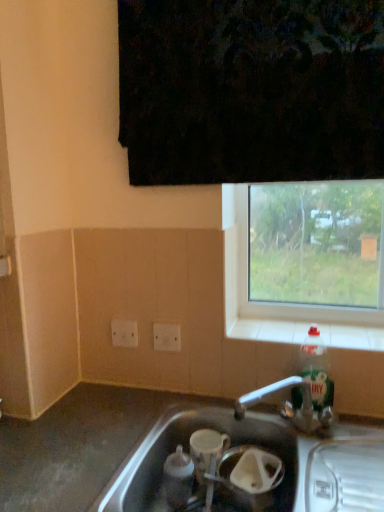
Question: Considering the relative positions of white plastic electric outlet at lower left, the 2th electric outlet when ordered from front to back, and white tile at lower right in the image provided, is white plastic electric outlet at lower left, the 2th electric outlet when ordered from front to back, in front of white tile at lower right?

Choices:
 (A) no
 (B) yes

Answer: (A)

Question: Can white tile at lower right be found inside white plastic electric outlet at lower left, the 2th electric outlet when ordered from front to back?

Choices:
 (A) yes
 (B) no

Answer: (B)

Question: Is white plastic electric outlet at lower left, which is counted as the 1th electric outlet, starting from the left, oriented towards white tile at lower right?

Choices:
 (A) no
 (B) yes

Answer: (A)

Question: From the image's perspective, is white plastic electric outlet at lower left, which is the 1th electric outlet in back-to-front order, on top of white tile at lower right?

Choices:
 (A) yes
 (B) no

Answer: (B)

Question: Considering the relative positions of white plastic electric outlet at lower left, the 2th electric outlet when ordered from front to back, and white tile at lower right in the image provided, is white plastic electric outlet at lower left, the 2th electric outlet when ordered from front to back, to the left of white tile at lower right from the viewer's perspective?

Choices:
 (A) yes
 (B) no

Answer: (A)

Question: Would you say white plastic electric outlet at lower left, which is counted as the 1th electric outlet, starting from the left, is outside white tile at lower right?

Choices:
 (A) no
 (B) yes

Answer: (B)

Question: From a real-world perspective, is white plastic electric outlet at lower left, the 2th electric outlet when ordered from front to back, located beneath silver metallic sink at lower center?

Choices:
 (A) no
 (B) yes

Answer: (A)

Question: From the image's perspective, is white plastic electric outlet at lower left, the second electric outlet in the right-to-left sequence, under silver metallic sink at lower center?

Choices:
 (A) yes
 (B) no

Answer: (B)

Question: Is white plastic electric outlet at lower left, which is counted as the 1th electric outlet, starting from the left, looking in the opposite direction of silver metallic sink at lower center?

Choices:
 (A) yes
 (B) no

Answer: (B)

Question: Is white plastic electric outlet at lower left, the second electric outlet in the right-to-left sequence, to the right of silver metallic sink at lower center from the viewer's perspective?

Choices:
 (A) yes
 (B) no

Answer: (B)

Question: From the image's perspective, is white plastic electric outlet at lower left, the 2th electric outlet when ordered from front to back, located above silver metallic sink at lower center?

Choices:
 (A) no
 (B) yes

Answer: (B)

Question: Can you confirm if white plastic electric outlet at lower left, the second electric outlet in the right-to-left sequence, is bigger than silver metallic sink at lower center?

Choices:
 (A) yes
 (B) no

Answer: (B)

Question: Can you confirm if white plastic electric outlet at lower left, the 2th electric outlet when ordered from front to back, is wider than translucent plastic bottle at right?

Choices:
 (A) yes
 (B) no

Answer: (B)